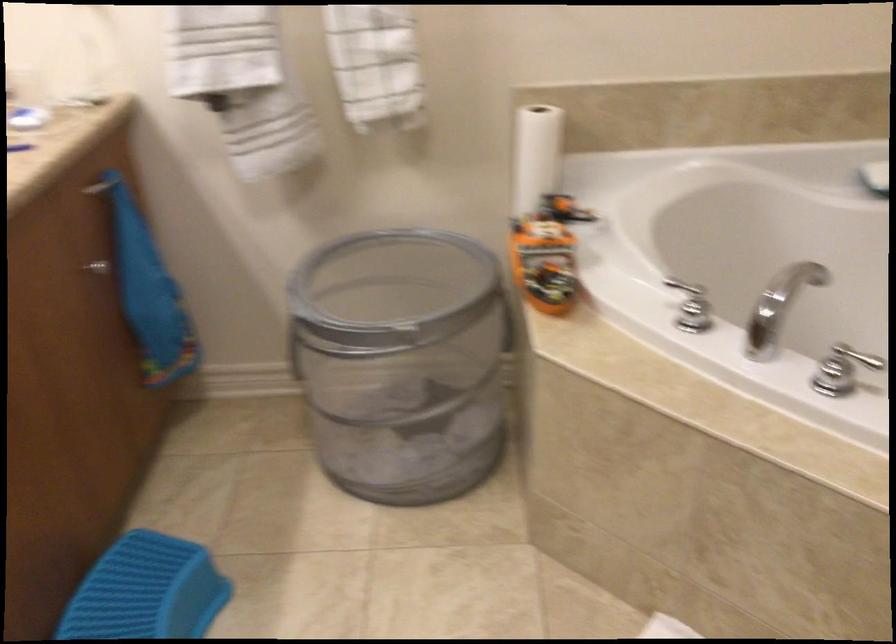
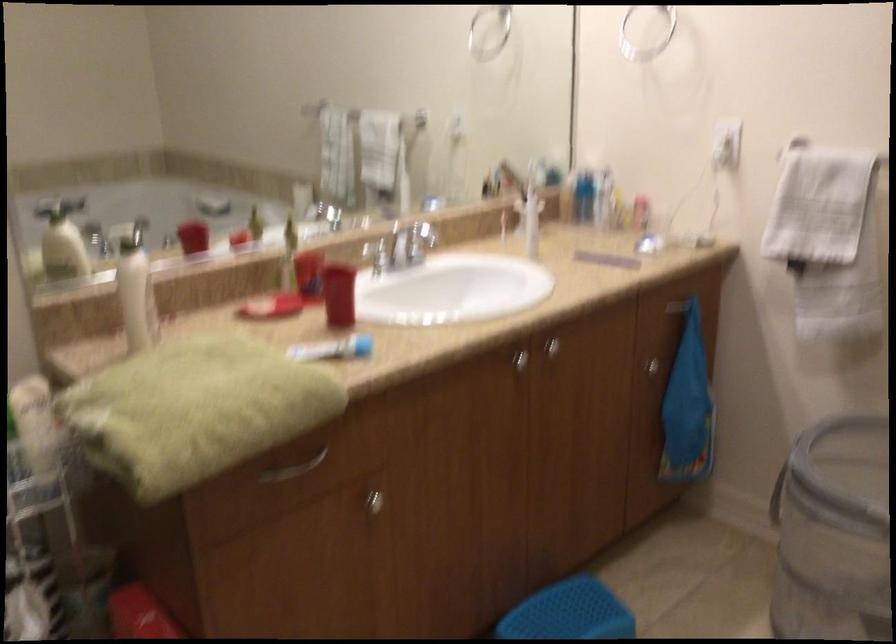
Where in the second image is the point corresponding to pixel 366 368 from the first image?

(833, 533)